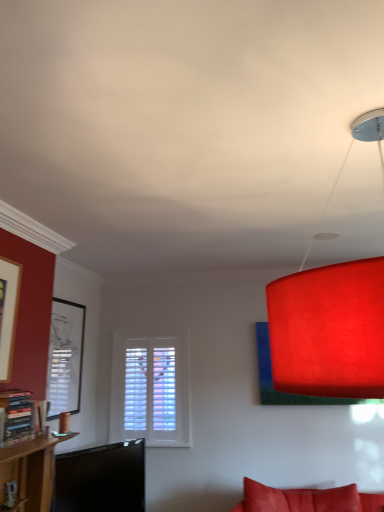
Question: Is wooden bookshelf at left not within matte red lampshade at upper right?

Choices:
 (A) no
 (B) yes

Answer: (B)

Question: Can you confirm if wooden bookshelf at left is positioned to the left of matte red lampshade at upper right?

Choices:
 (A) yes
 (B) no

Answer: (A)

Question: Does wooden bookshelf at left appear on the right side of matte red lampshade at upper right?

Choices:
 (A) yes
 (B) no

Answer: (B)

Question: Is wooden bookshelf at left surrounding matte red lampshade at upper right?

Choices:
 (A) no
 (B) yes

Answer: (A)

Question: Can you confirm if wooden bookshelf at left is wider than matte red lampshade at upper right?

Choices:
 (A) yes
 (B) no

Answer: (B)

Question: Relative to matte red lampshade at upper right, is wooden bookshelf at left in front or behind?

Choices:
 (A) behind
 (B) front

Answer: (A)

Question: From their relative heights in the image, would you say wooden bookshelf at left is taller or shorter than matte red lampshade at upper right?

Choices:
 (A) tall
 (B) short

Answer: (B)

Question: Would you say wooden bookshelf at left is inside or outside matte red lampshade at upper right?

Choices:
 (A) inside
 (B) outside

Answer: (B)

Question: From the image's perspective, is wooden bookshelf at left above or below matte red lampshade at upper right?

Choices:
 (A) above
 (B) below

Answer: (B)

Question: From the image's perspective, is wooden bookshelf at left above or below matte black picture frame at left?

Choices:
 (A) below
 (B) above

Answer: (B)

Question: In terms of height, does wooden bookshelf at left look taller or shorter compared to matte black picture frame at left?

Choices:
 (A) short
 (B) tall

Answer: (A)

Question: Considering the positions of point (26, 396) and point (82, 317), is point (26, 396) closer or farther from the camera than point (82, 317)?

Choices:
 (A) closer
 (B) farther

Answer: (A)

Question: In terms of size, does wooden bookshelf at left appear bigger or smaller than matte black picture frame at left?

Choices:
 (A) small
 (B) big

Answer: (A)

Question: From the image's perspective, relative to matte black picture frame at left, is matte red lampshade at upper right above or below?

Choices:
 (A) below
 (B) above

Answer: (B)

Question: Based on their sizes in the image, would you say matte red lampshade at upper right is bigger or smaller than matte black picture frame at left?

Choices:
 (A) small
 (B) big

Answer: (B)